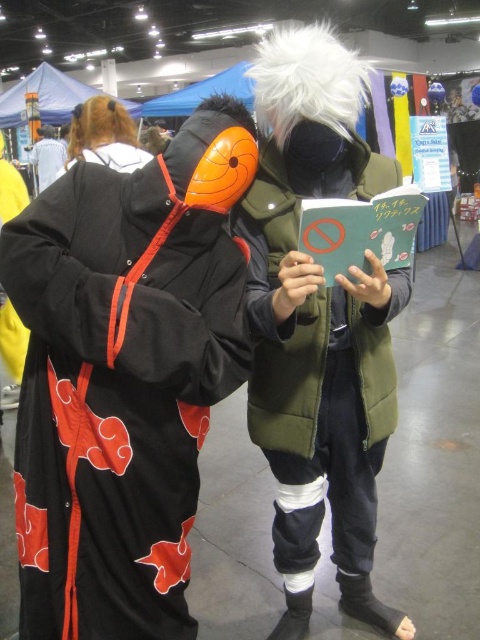
Question: Among these points, which one is nearest to the camera?

Choices:
 (A) (38, 561)
 (B) (360, 301)

Answer: (A)

Question: Is black fabric cloak at left to the left of matte green vest at center from the viewer's perspective?

Choices:
 (A) no
 (B) yes

Answer: (B)

Question: Among these objects, which one is nearest to the camera?

Choices:
 (A) matte green vest at center
 (B) black fabric cloak at left

Answer: (B)

Question: Is black fabric cloak at left to the left of matte green vest at center from the viewer's perspective?

Choices:
 (A) yes
 (B) no

Answer: (A)

Question: Considering the relative positions of black fabric cloak at left and matte green vest at center in the image provided, where is black fabric cloak at left located with respect to matte green vest at center?

Choices:
 (A) below
 (B) above

Answer: (A)